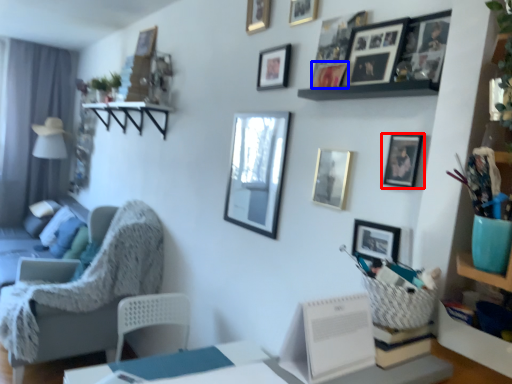
Question: Among these objects, which one is nearest to the camera, picture frame (highlighted by a red box) or picture frame (highlighted by a blue box)?

Choices:
 (A) picture frame
 (B) picture frame

Answer: (A)